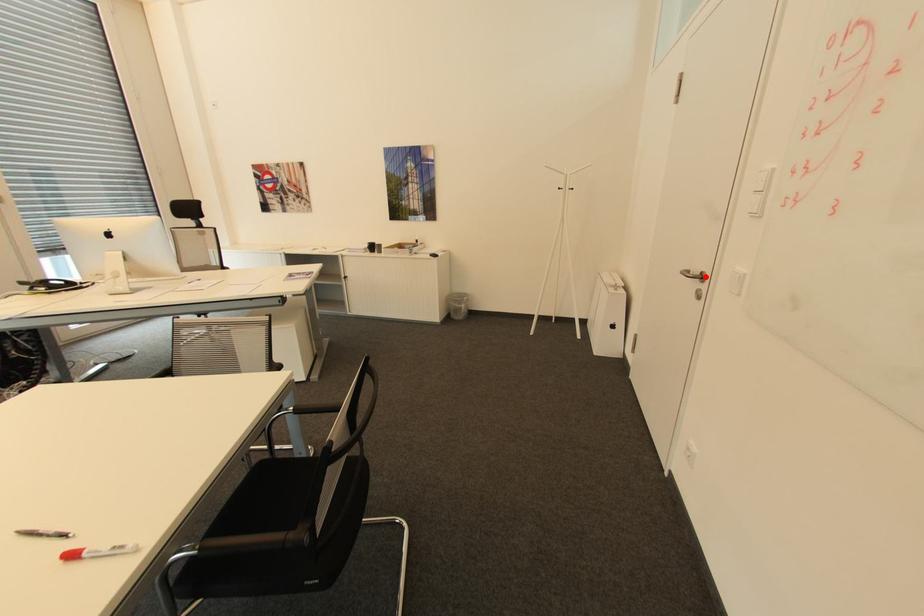
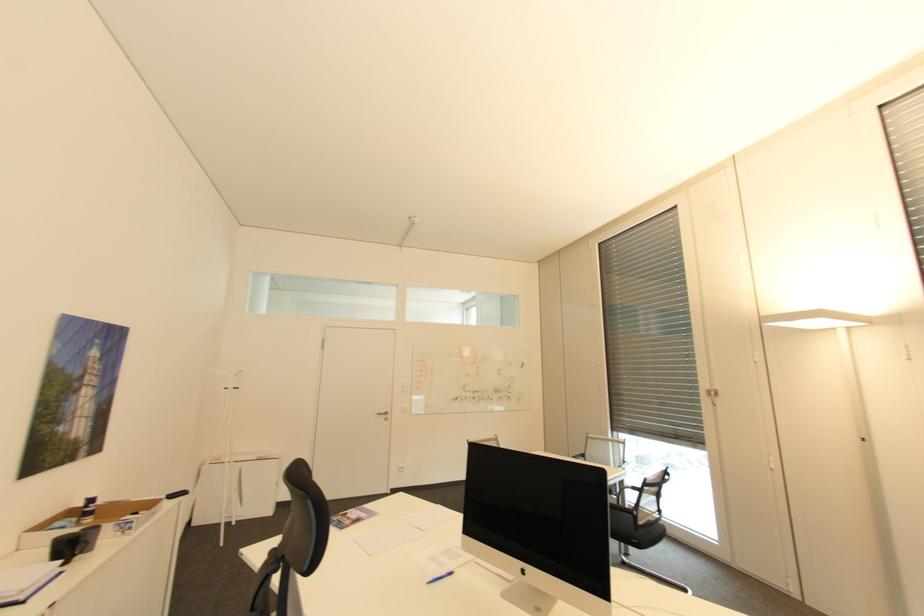
Question: A red point is marked in image1. In image2, is the corresponding 3D point closer to the camera or farther? Reply with the corresponding letter.

Choices:
 (A) The corresponding 3D point is closer.
 (B) The corresponding 3D point is farther.

Answer: (B)